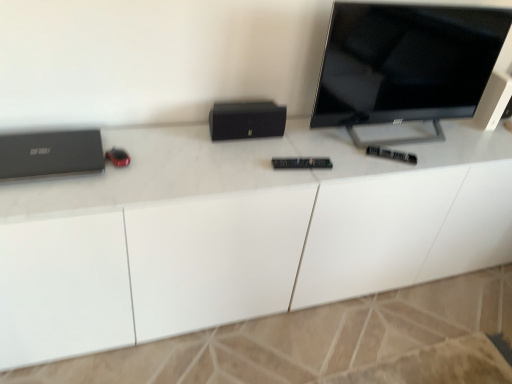
In order to click on free area behind black plastic remote at center in this screenshot , I will do `click(378, 134)`.